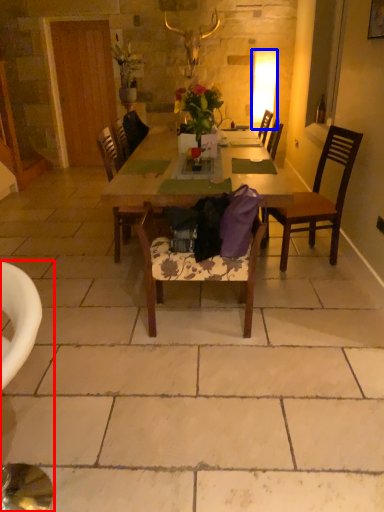
Question: Which object appears closest to the camera in this image, chair (highlighted by a red box) or lamp (highlighted by a blue box)?

Choices:
 (A) chair
 (B) lamp

Answer: (A)